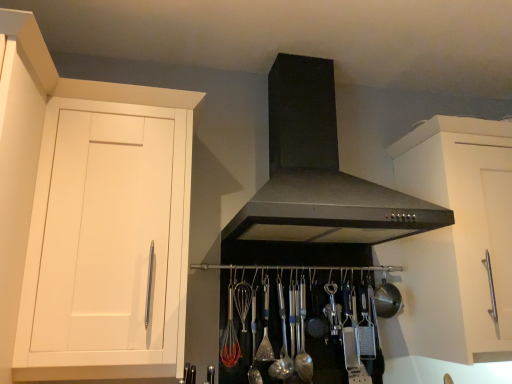
Question: Does satin silver spoon at center, marked as the 1th utensil in a left-to-right arrangement, come behind satin silver spoon at center, which appears as the second utensil when viewed from the right?

Choices:
 (A) no
 (B) yes

Answer: (B)

Question: Could you tell me if satin silver spoon at center, marked as the 1th utensil in a left-to-right arrangement, is turned towards satin silver spoon at center, which appears as the second utensil when viewed from the right?

Choices:
 (A) no
 (B) yes

Answer: (A)

Question: Can you confirm if satin silver spoon at center, marked as the 4th utensil in a right-to-left arrangement, is taller than satin silver spoon at center, which appears as the second utensil when viewed from the right?

Choices:
 (A) no
 (B) yes

Answer: (B)

Question: Can you confirm if satin silver spoon at center, marked as the 1th utensil in a left-to-right arrangement, is positioned to the left of satin silver spoon at center, placed as the third utensil when sorted from left to right?

Choices:
 (A) yes
 (B) no

Answer: (A)

Question: Considering the relative sizes of satin silver spoon at center, marked as the 1th utensil in a left-to-right arrangement, and satin silver spoon at center, which appears as the second utensil when viewed from the right, in the image provided, is satin silver spoon at center, marked as the 1th utensil in a left-to-right arrangement, bigger than satin silver spoon at center, which appears as the second utensil when viewed from the right,?

Choices:
 (A) yes
 (B) no

Answer: (B)

Question: Does satin silver spoon at center, marked as the 1th utensil in a left-to-right arrangement, have a greater width compared to satin silver spoon at center, placed as the third utensil when sorted from left to right?

Choices:
 (A) yes
 (B) no

Answer: (B)

Question: Does metallic silver bowl at center have a larger size compared to polished silver spoon at center, which ranks as the 3th utensil in right-to-left order?

Choices:
 (A) yes
 (B) no

Answer: (A)

Question: Can you confirm if metallic silver bowl at center is shorter than polished silver spoon at center, marked as the second utensil in a left-to-right arrangement?

Choices:
 (A) yes
 (B) no

Answer: (A)

Question: Is metallic silver bowl at center at the left side of polished silver spoon at center, marked as the second utensil in a left-to-right arrangement?

Choices:
 (A) yes
 (B) no

Answer: (B)

Question: Is metallic silver bowl at center aimed at polished silver spoon at center, marked as the second utensil in a left-to-right arrangement?

Choices:
 (A) yes
 (B) no

Answer: (B)

Question: Could polished silver spoon at center, marked as the second utensil in a left-to-right arrangement, be considered to be inside metallic silver bowl at center?

Choices:
 (A) yes
 (B) no

Answer: (B)

Question: Can you confirm if metallic silver bowl at center is taller than polished silver spoon at center, marked as the second utensil in a left-to-right arrangement?

Choices:
 (A) no
 (B) yes

Answer: (A)

Question: Is satin silver spoon at center, marked as the 1th utensil in a left-to-right arrangement, directly adjacent to satin silver spoon at center, the 4th utensil from the left?

Choices:
 (A) no
 (B) yes

Answer: (A)